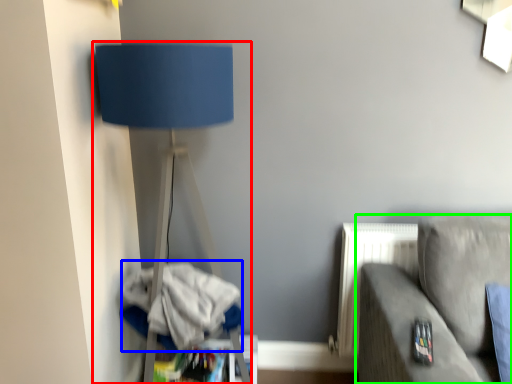
Question: Estimate the real-world distances between objects in this image. Which object is farther from lamp (highlighted by a red box), laundry (highlighted by a blue box) or studio couch (highlighted by a green box)?

Choices:
 (A) laundry
 (B) studio couch

Answer: (B)